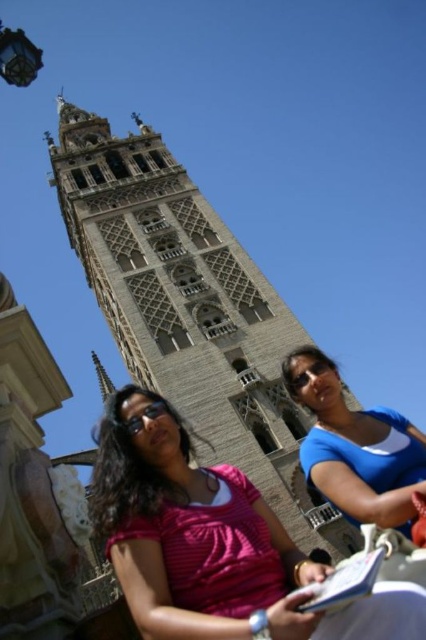
Does stone tower at center have a larger size compared to blue fabric shirt at lower right?

Correct, stone tower at center is larger in size than blue fabric shirt at lower right.

Locate an element on the screen. stone tower at center is located at coordinates (189, 307).

Consider the image. Between pink striped shirt at lower center and blue fabric shirt at lower right, which one has less height?

Standing shorter between the two is blue fabric shirt at lower right.

Is point (180, 416) positioned in front of point (321, 438)?

No, (180, 416) is behind (321, 438).

This screenshot has width=426, height=640. Find the location of `pink striped shirt at lower center`. pink striped shirt at lower center is located at coordinates (213, 545).

Who is more distant from viewer, (317, 420) or (120, 426)?

The point (317, 420) is more distant.

Does blue fabric shirt at lower right appear on the left side of black matte goggles at lower center?

In fact, blue fabric shirt at lower right is to the right of black matte goggles at lower center.

Is point (302, 353) positioned after point (129, 422)?

Yes, point (302, 353) is farther from viewer.

Find the location of a particular element. The width and height of the screenshot is (426, 640). blue fabric shirt at lower right is located at coordinates (354, 445).